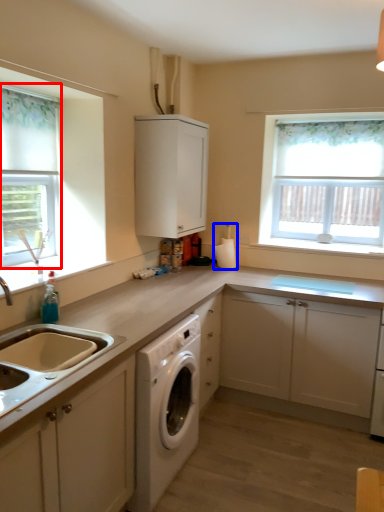
Question: Which point is further to the camera, bay window (highlighted by a red box) or appliance (highlighted by a blue box)?

Choices:
 (A) bay window
 (B) appliance

Answer: (B)